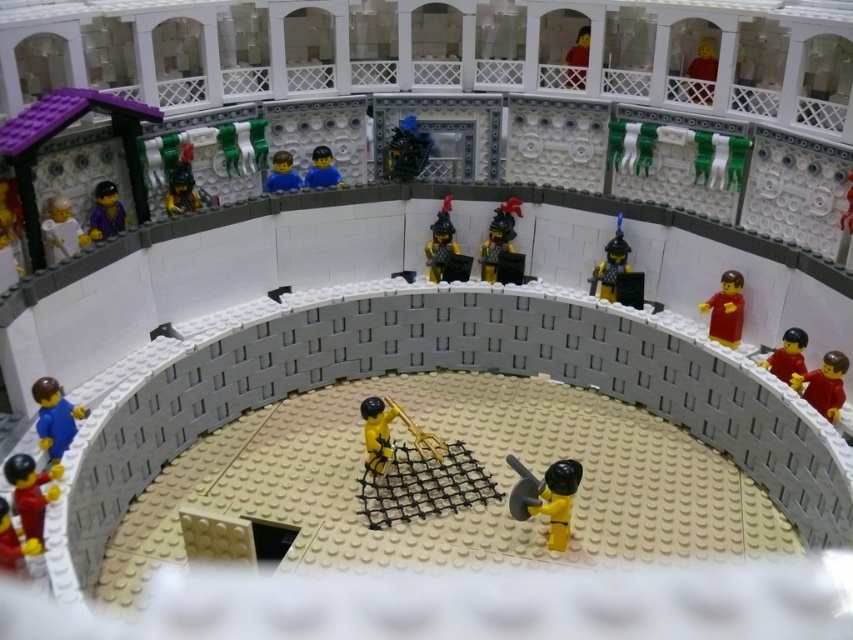
Question: Does smooth plastic minifigure at upper right come behind matte black helmet at upper left?

Choices:
 (A) yes
 (B) no

Answer: (A)

Question: Which point is farther to the camera?

Choices:
 (A) (6, 538)
 (B) (328, 156)
 (C) (94, 218)

Answer: (B)

Question: Can you confirm if red plastic figure at right is positioned to the left of shiny blue armor at center?

Choices:
 (A) yes
 (B) no

Answer: (B)

Question: Does red plastic figure at right have a greater width compared to shiny blue armor at center?

Choices:
 (A) yes
 (B) no

Answer: (B)

Question: Among these objects, which one is farthest from the camera?

Choices:
 (A) blue matte figure at center
 (B) matte yellow figure at center

Answer: (A)

Question: Which object appears farthest from the camera in this image?

Choices:
 (A) yellow plastic figure at lower left
 (B) purple matte minifigure at upper left
 (C) blue matte figure at lower left

Answer: (B)